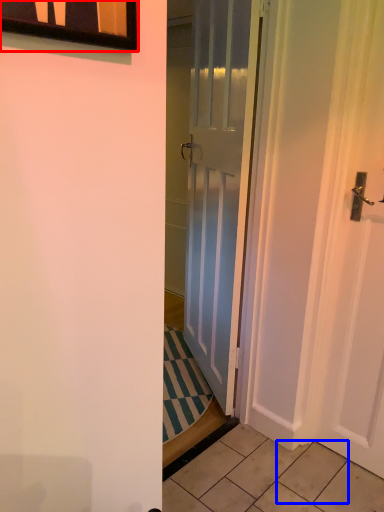
Question: Which of the following is the closest to the observer, window (highlighted by a red box) or tile (highlighted by a blue box)?

Choices:
 (A) window
 (B) tile

Answer: (A)